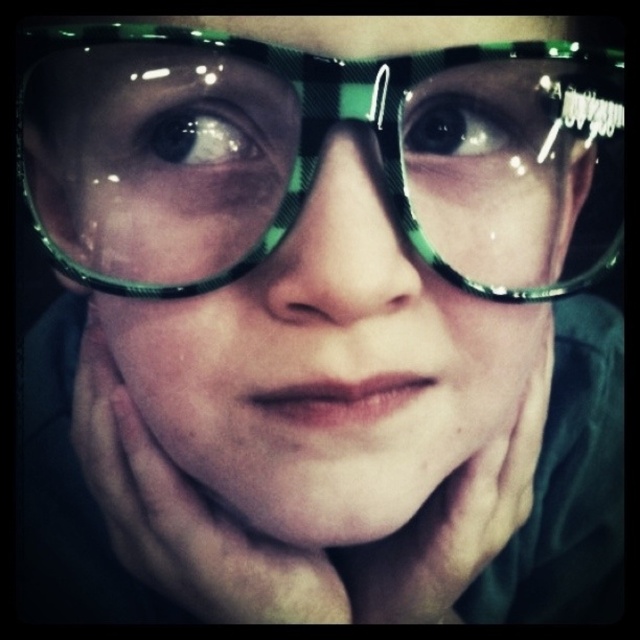
Question: Which point is closer to the camera?

Choices:
 (A) (513, 145)
 (B) (321, 76)
 (C) (400, 452)

Answer: (B)

Question: Among these points, which one is nearest to the camera?

Choices:
 (A) (486, 132)
 (B) (140, 140)
 (C) (333, 125)
 (D) (472, 326)

Answer: (C)

Question: Is green shiny glasses at center positioned before black glossy eye at center?

Choices:
 (A) yes
 (B) no

Answer: (A)

Question: Does brown glossy eye at upper left have a smaller size compared to black glossy eye at center?

Choices:
 (A) yes
 (B) no

Answer: (A)

Question: Which object appears farthest from the camera in this image?

Choices:
 (A) black glossy eye at center
 (B) brown glossy eye at upper left

Answer: (B)

Question: Is green plastic glasses at center to the right of brown glossy eye at upper left from the viewer's perspective?

Choices:
 (A) no
 (B) yes

Answer: (B)